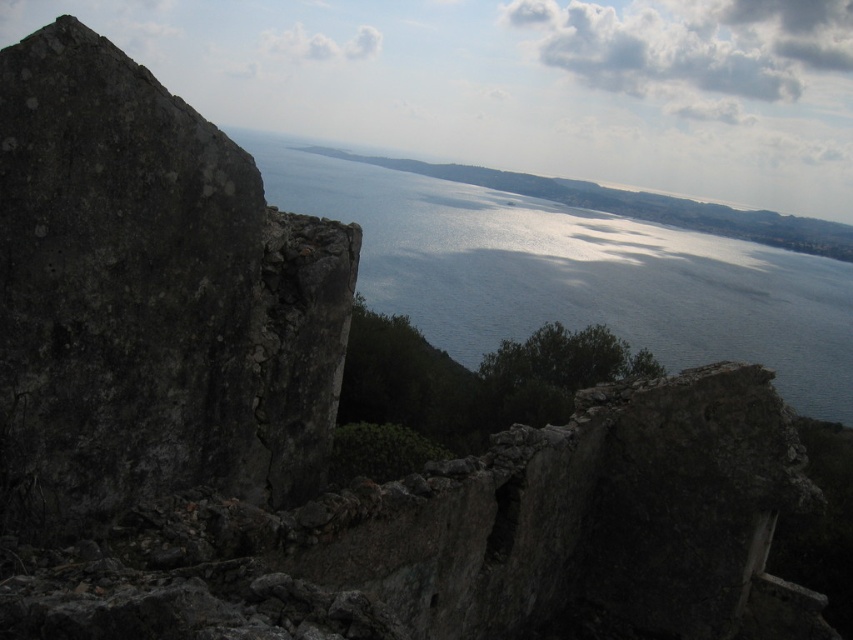
Is dark gray stone at left taller than shiny blue water at center?

Incorrect, dark gray stone at left's height is not larger of shiny blue water at center's.

Between point (25, 444) and point (811, 387), which one is positioned in front?

Point (25, 444)

This screenshot has height=640, width=853. What are the coordinates of `dark gray stone at left` in the screenshot? It's located at [149, 298].